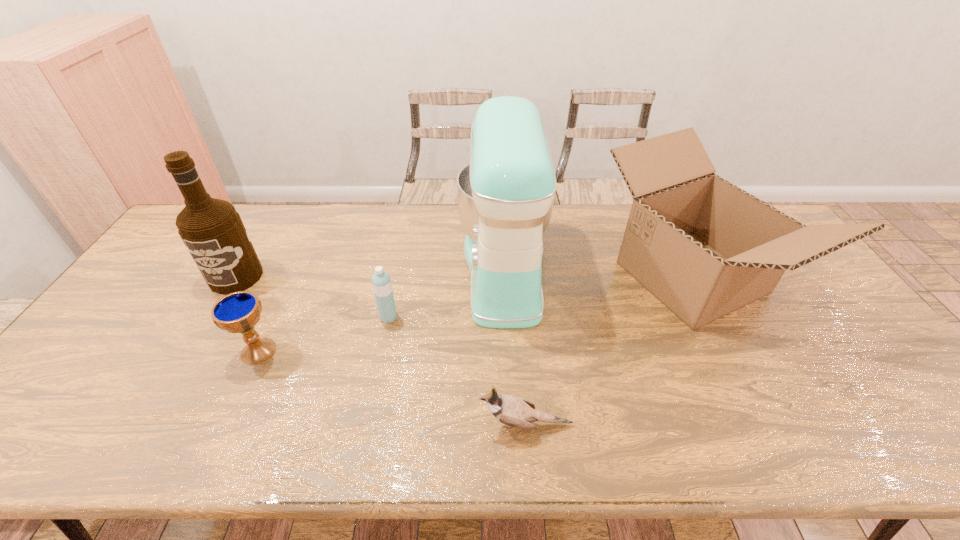
You are a GUI agent. You are given a task and a screenshot of the screen. Output one action in this format:
    pyautogui.click(x=<x>, y=<y>)
    Task: Click on the free location located 0.260m at the base of the mixer
    This screenshot has width=960, height=540.
    Given the screenshot: What is the action you would take?
    pyautogui.click(x=374, y=271)

This screenshot has height=540, width=960. I want to click on vacant point located 0.050m on the label of the second tallest object, so click(x=218, y=307).

The image size is (960, 540). I want to click on vacant area situated on the left of the rightmost object, so click(560, 278).

Find the location of `free region located 0.060m on the right of the third object from left to right`. free region located 0.060m on the right of the third object from left to right is located at coordinates (419, 317).

The image size is (960, 540). Find the location of `free spot located on the back of the second object from left to right`. free spot located on the back of the second object from left to right is located at coordinates (304, 250).

Identify the location of free location located at the face of the nearest object. The height and width of the screenshot is (540, 960). (398, 424).

This screenshot has height=540, width=960. I want to click on vacant space located at the face of the nearest object, so click(x=349, y=424).

Find the location of a particular element. Image resolution: width=960 pixels, height=540 pixels. vacant space situated at the face of the nearest object is located at coordinates (331, 424).

The width and height of the screenshot is (960, 540). What are the coordinates of `mixer located in the far edge section of the desktop` in the screenshot? It's located at (506, 193).

Find the location of a particular element. Image resolution: width=960 pixels, height=540 pixels. box situated at the far edge is located at coordinates (704, 247).